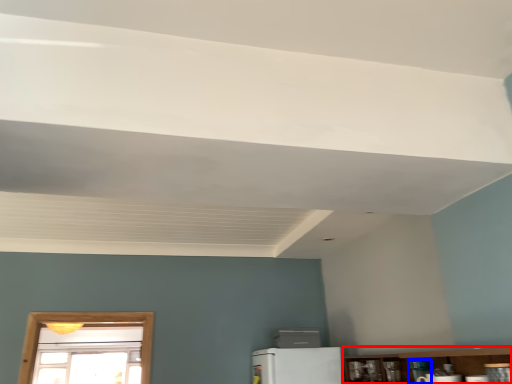
Question: Among these objects, which one is nearest to the camera, shelf (highlighted by a red box) or appliance (highlighted by a blue box)?

Choices:
 (A) shelf
 (B) appliance

Answer: (A)